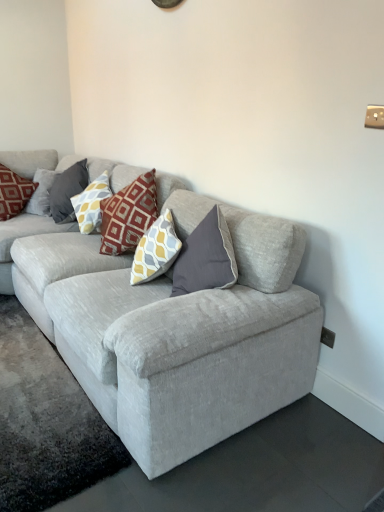
Question: Which direction should I rotate to face yellow and gray patterned pillow at center, the 3th pillow when ordered from left to right, — up or down?

Choices:
 (A) up
 (B) down

Answer: (A)

Question: Is light gray fabric couch at center facing away from yellow and gray patterned pillow at center, the first pillow from the right?

Choices:
 (A) yes
 (B) no

Answer: (A)

Question: From a real-world perspective, is light gray fabric couch at center below yellow and gray patterned pillow at center, the 3th pillow when ordered from left to right?

Choices:
 (A) yes
 (B) no

Answer: (A)

Question: Does light gray fabric couch at center have a greater height compared to yellow and gray patterned pillow at center, the first pillow from the right?

Choices:
 (A) no
 (B) yes

Answer: (B)

Question: Does light gray fabric couch at center have a lesser height compared to yellow and gray patterned pillow at center, the first pillow from the right?

Choices:
 (A) no
 (B) yes

Answer: (A)

Question: Considering the relative positions of light gray fabric couch at center and yellow and gray patterned pillow at center, the first pillow from the right, in the image provided, is light gray fabric couch at center to the left of yellow and gray patterned pillow at center, the first pillow from the right, from the viewer's perspective?

Choices:
 (A) no
 (B) yes

Answer: (B)

Question: Can yellow and gray patterned pillow at center, the 3th pillow when ordered from left to right, be found inside light gray fabric couch at center?

Choices:
 (A) yes
 (B) no

Answer: (A)

Question: Is light gray fabric couch at center thinner than matte red pillow at upper left, placed as the third pillow when sorted from right to left?

Choices:
 (A) no
 (B) yes

Answer: (A)

Question: From the image's perspective, would you say light gray fabric couch at center is positioned over matte red pillow at upper left, which appears as the 1th pillow when viewed from the left?

Choices:
 (A) no
 (B) yes

Answer: (A)

Question: Could matte red pillow at upper left, placed as the third pillow when sorted from right to left, be considered to be inside light gray fabric couch at center?

Choices:
 (A) no
 (B) yes

Answer: (B)

Question: Does light gray fabric couch at center appear on the right side of matte red pillow at upper left, placed as the third pillow when sorted from right to left?

Choices:
 (A) no
 (B) yes

Answer: (B)

Question: From a real-world perspective, is light gray fabric couch at center below matte red pillow at upper left, which appears as the 1th pillow when viewed from the left?

Choices:
 (A) no
 (B) yes

Answer: (B)

Question: Can you confirm if light gray fabric couch at center is shorter than matte red pillow at upper left, which appears as the 1th pillow when viewed from the left?

Choices:
 (A) yes
 (B) no

Answer: (B)

Question: Can you confirm if light gray fabric couch at center is positioned to the left of yellow and gray patterned pillow at upper left, the second pillow from the left?

Choices:
 (A) yes
 (B) no

Answer: (B)